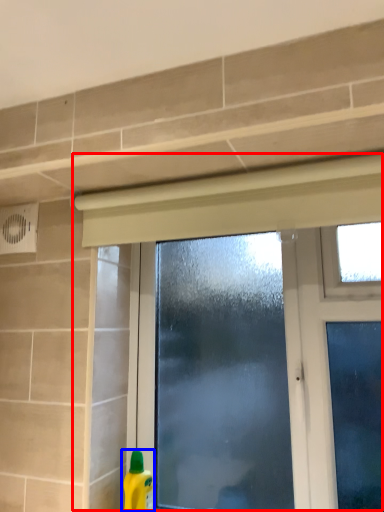
Question: Which object appears closest to the camera in this image, window (highlighted by a red box) or cleaning product (highlighted by a blue box)?

Choices:
 (A) window
 (B) cleaning product

Answer: (A)